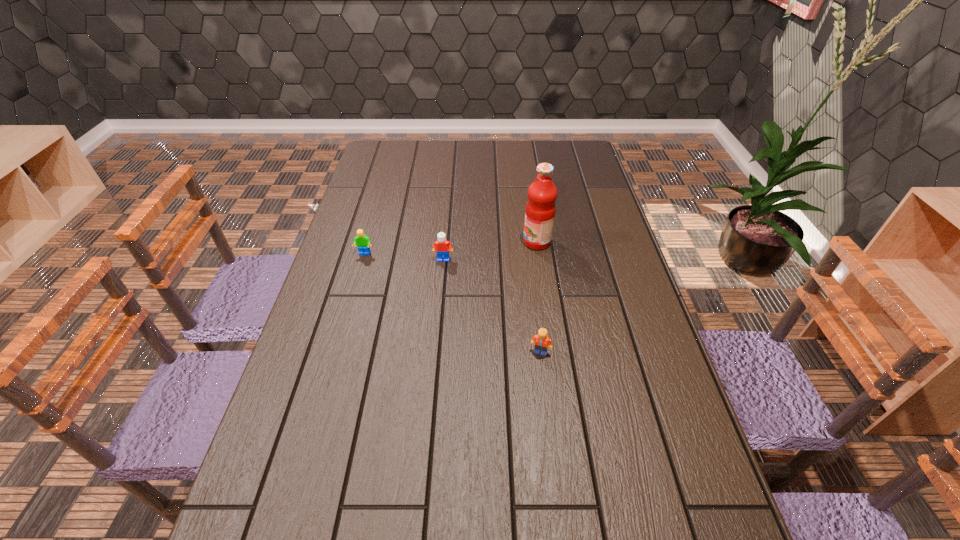
Find the location of a particular element. The height and width of the screenshot is (540, 960). vacant area that lies between the leftmost object and the third object from right to left is located at coordinates (404, 256).

Identify the location of vacant area that lies between the rightmost Lego and the fruit juice. (539, 297).

What are the coordinates of `unoccupied position between the third object from right to left and the tallest object` in the screenshot? It's located at (491, 251).

This screenshot has width=960, height=540. What are the coordinates of `blank region between the nearest Lego and the second object from left to right` in the screenshot? It's located at pyautogui.click(x=492, y=306).

Choose which object is the nearest neighbor to the tallest object. Please provide its 2D coordinates. Your answer should be formatted as a tuple, i.e. [(x, y)], where the tuple contains the x and y coordinates of a point satisfying the conditions above.

[(443, 247)]

Select which object is the second closest to the tallest object. Please provide its 2D coordinates. Your answer should be formatted as a tuple, i.e. [(x, y)], where the tuple contains the x and y coordinates of a point satisfying the conditions above.

[(541, 341)]

Select which Lego appears as the third closest to the fruit juice. Please provide its 2D coordinates. Your answer should be formatted as a tuple, i.e. [(x, y)], where the tuple contains the x and y coordinates of a point satisfying the conditions above.

[(362, 241)]

Select which Lego is the closest to the nearest Lego. Please provide its 2D coordinates. Your answer should be formatted as a tuple, i.e. [(x, y)], where the tuple contains the x and y coordinates of a point satisfying the conditions above.

[(443, 247)]

Image resolution: width=960 pixels, height=540 pixels. Find the location of `free space that satisfies the following two spatial constraints: 1. on the front label of the tallest object; 2. on the face of the second Lego from left to right`. free space that satisfies the following two spatial constraints: 1. on the front label of the tallest object; 2. on the face of the second Lego from left to right is located at coordinates (540, 259).

Identify the location of free point that satisfies the following two spatial constraints: 1. on the front label of the fruit juice; 2. on the face of the leftmost object. (539, 254).